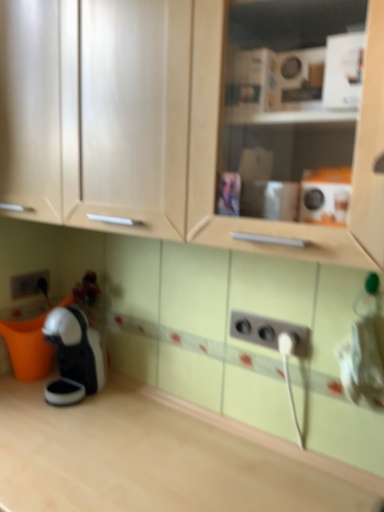
What are the coordinates of `white plastic outlet at lower center, acting as the 1th electric outlet starting from the front` in the screenshot? It's located at (269, 332).

This screenshot has width=384, height=512. What are the coordinates of `matte wood cabinet at upper center` in the screenshot? It's located at (151, 125).

The image size is (384, 512). What do you see at coordinates (77, 347) in the screenshot?
I see `black plastic coffee machine at lower left` at bounding box center [77, 347].

Where is `black plastic coffee machine at lower left`? The image size is (384, 512). black plastic coffee machine at lower left is located at coordinates (77, 347).

What is the approximate width of light wood countertop at lower left?

The width of light wood countertop at lower left is 51.89 centimeters.

The height and width of the screenshot is (512, 384). Describe the element at coordinates (158, 457) in the screenshot. I see `light wood countertop at lower left` at that location.

This screenshot has height=512, width=384. What are the coordinates of `white plastic outlet at lower center, the second electric outlet viewed from the left` in the screenshot? It's located at (269, 332).

Between black plastic coffee machine at lower left and matte wood cabinet at upper center, which one has larger width?

matte wood cabinet at upper center is wider.

Which of these two, black plastic coffee machine at lower left or matte wood cabinet at upper center, is bigger?

Bigger between the two is matte wood cabinet at upper center.

In the scene shown: Does black plastic coffee machine at lower left have a lesser height compared to matte wood cabinet at upper center?

Yes, black plastic coffee machine at lower left is shorter than matte wood cabinet at upper center.

Is black plastic coffee machine at lower left inside or outside of matte gray electric outlet at lower left, which ranks as the 1th electric outlet in top-to-bottom order?

The correct answer is: outside.

In the scene shown: Is black plastic coffee machine at lower left in front of or behind matte gray electric outlet at lower left, which is the 1th electric outlet from back to front, in the image?

black plastic coffee machine at lower left is positioned closer to the viewer than matte gray electric outlet at lower left, which is the 1th electric outlet from back to front.

Is point (62, 341) behind point (33, 272)?

No, it is in front of (33, 272).

Can you confirm if black plastic coffee machine at lower left is taller than matte gray electric outlet at lower left, which is the 1th electric outlet from back to front?

Correct, black plastic coffee machine at lower left is much taller as matte gray electric outlet at lower left, which is the 1th electric outlet from back to front.

Can you confirm if black plastic coffee machine at lower left is bigger than white plastic outlet at lower center, which is the second electric outlet in top-to-bottom order?

Yes, black plastic coffee machine at lower left is bigger than white plastic outlet at lower center, which is the second electric outlet in top-to-bottom order.

In the image, is black plastic coffee machine at lower left positioned in front of or behind white plastic outlet at lower center, placed as the first electric outlet when sorted from right to left?

Clearly, black plastic coffee machine at lower left is behind white plastic outlet at lower center, placed as the first electric outlet when sorted from right to left.

Which is correct: black plastic coffee machine at lower left is inside white plastic outlet at lower center, acting as the first electric outlet starting from the bottom, or outside of it?

The correct answer is: outside.

Is black plastic coffee machine at lower left facing away from white plastic outlet at lower center, the second electric outlet viewed from the left?

No, black plastic coffee machine at lower left is not facing away from white plastic outlet at lower center, the second electric outlet viewed from the left.

From a real-world perspective, which is physically below, matte gray electric outlet at lower left, which is counted as the second electric outlet, starting from the right, or light wood countertop at lower left?

In real-world perspective, light wood countertop at lower left is lower.

Is light wood countertop at lower left surrounded by matte gray electric outlet at lower left, which ranks as the 1th electric outlet in top-to-bottom order?

No, light wood countertop at lower left is not inside matte gray electric outlet at lower left, which ranks as the 1th electric outlet in top-to-bottom order.

Locate an element on the screen. the 1st electric outlet located above the light wood countertop at lower left (from a real-world perspective) is located at coordinates (28, 284).

Could you tell me if matte gray electric outlet at lower left, which is counted as the second electric outlet, starting from the right, is turned towards light wood countertop at lower left?

No.

Based on their sizes in the image, would you say light wood countertop at lower left is bigger or smaller than white plastic outlet at lower center, acting as the 1th electric outlet starting from the front?

In the image, light wood countertop at lower left appears to be larger than white plastic outlet at lower center, acting as the 1th electric outlet starting from the front.

Considering the relative positions of light wood countertop at lower left and white plastic outlet at lower center, acting as the first electric outlet starting from the bottom, in the image provided, is light wood countertop at lower left to the right of white plastic outlet at lower center, acting as the first electric outlet starting from the bottom, from the viewer's perspective?

No.

Between light wood countertop at lower left and white plastic outlet at lower center, acting as the first electric outlet starting from the bottom, which one has more height?

light wood countertop at lower left.

Is matte gray electric outlet at lower left, the second electric outlet from the front, at the left side of white plastic outlet at lower center, which is the second electric outlet in top-to-bottom order?

Correct, you'll find matte gray electric outlet at lower left, the second electric outlet from the front, to the left of white plastic outlet at lower center, which is the second electric outlet in top-to-bottom order.

Based on the photo, is matte gray electric outlet at lower left, which ranks as the 2th electric outlet in bottom-to-top order, touching white plastic outlet at lower center, acting as the first electric outlet starting from the bottom?

matte gray electric outlet at lower left, which ranks as the 2th electric outlet in bottom-to-top order, is not next to white plastic outlet at lower center, acting as the first electric outlet starting from the bottom, and they're not touching.

From the image's perspective, is matte gray electric outlet at lower left, which is the 1th electric outlet from back to front, beneath white plastic outlet at lower center, acting as the 1th electric outlet starting from the front?

Incorrect, from the image's perspective, matte gray electric outlet at lower left, which is the 1th electric outlet from back to front, is higher than white plastic outlet at lower center, acting as the 1th electric outlet starting from the front.

Is matte gray electric outlet at lower left, which is the 1th electric outlet from back to front, situated inside white plastic outlet at lower center, acting as the 1th electric outlet starting from the front, or outside?

matte gray electric outlet at lower left, which is the 1th electric outlet from back to front, is spatially situated outside white plastic outlet at lower center, acting as the 1th electric outlet starting from the front.

From the image's perspective, is matte wood cabinet at upper center under black plastic coffee machine at lower left?

No, from the image's perspective, matte wood cabinet at upper center is not beneath black plastic coffee machine at lower left.

Is matte wood cabinet at upper center facing away from black plastic coffee machine at lower left?

matte wood cabinet at upper center does not have its back to black plastic coffee machine at lower left.

Considering the relative sizes of matte wood cabinet at upper center and black plastic coffee machine at lower left in the image provided, is matte wood cabinet at upper center taller than black plastic coffee machine at lower left?

Indeed, matte wood cabinet at upper center has a greater height compared to black plastic coffee machine at lower left.

Locate an element on the screen. cabinetry above the black plastic coffee machine at lower left (from a real-world perspective) is located at coordinates (151, 125).

From the image's perspective, count 2nd electric outlets upward from the black plastic coffee machine at lower left and point to it. Please provide its 2D coordinates.

[(28, 284)]

From the image, which object appears to be farther from white plastic outlet at lower center, acting as the first electric outlet starting from the bottom, matte gray electric outlet at lower left, which ranks as the 2th electric outlet in bottom-to-top order, or light wood countertop at lower left?

matte gray electric outlet at lower left, which ranks as the 2th electric outlet in bottom-to-top order, is positioned further to the anchor white plastic outlet at lower center, acting as the first electric outlet starting from the bottom.

Which object lies nearer to the anchor point matte wood cabinet at upper center, matte gray electric outlet at lower left, which is the 1th electric outlet from back to front, or white plastic outlet at lower center, acting as the first electric outlet starting from the bottom?

Based on the image, white plastic outlet at lower center, acting as the first electric outlet starting from the bottom, appears to be nearer to matte wood cabinet at upper center.

When comparing their distances from black plastic coffee machine at lower left, does matte gray electric outlet at lower left, the first electric outlet positioned from the left, or matte wood cabinet at upper center seem closer?

matte gray electric outlet at lower left, the first electric outlet positioned from the left.

When comparing their distances from white plastic outlet at lower center, marked as the 2th electric outlet in a back-to-front arrangement, does matte wood cabinet at upper center or matte gray electric outlet at lower left, which ranks as the 2th electric outlet in bottom-to-top order, seem closer?

matte wood cabinet at upper center is closer to white plastic outlet at lower center, marked as the 2th electric outlet in a back-to-front arrangement.

Based on their spatial positions, is black plastic coffee machine at lower left or matte gray electric outlet at lower left, which ranks as the 1th electric outlet in top-to-bottom order, further from matte wood cabinet at upper center?

Among the two, matte gray electric outlet at lower left, which ranks as the 1th electric outlet in top-to-bottom order, is located further to matte wood cabinet at upper center.

Estimate the real-world distances between objects in this image. Which object is closer to light wood countertop at lower left, white plastic outlet at lower center, acting as the first electric outlet starting from the bottom, or matte wood cabinet at upper center?

Among the two, white plastic outlet at lower center, acting as the first electric outlet starting from the bottom, is located nearer to light wood countertop at lower left.

From the picture: From the image, which object appears to be farther from matte gray electric outlet at lower left, which is the 1th electric outlet from back to front, white plastic outlet at lower center, placed as the first electric outlet when sorted from right to left, or black plastic coffee machine at lower left?

Based on the image, white plastic outlet at lower center, placed as the first electric outlet when sorted from right to left, appears to be further to matte gray electric outlet at lower left, which is the 1th electric outlet from back to front.

Based on their spatial positions, is matte wood cabinet at upper center or light wood countertop at lower left further from matte gray electric outlet at lower left, which is counted as the second electric outlet, starting from the right?

matte wood cabinet at upper center.

Locate an element on the screen. Image resolution: width=384 pixels, height=512 pixels. toy between matte gray electric outlet at lower left, which is the 1th electric outlet from back to front, and white plastic outlet at lower center, acting as the 1th electric outlet starting from the front, from left to right is located at coordinates (77, 347).

Where is `toy between matte wood cabinet at upper center and light wood countertop at lower left in the vertical direction`? The width and height of the screenshot is (384, 512). toy between matte wood cabinet at upper center and light wood countertop at lower left in the vertical direction is located at coordinates (77, 347).

Where is `toy between matte wood cabinet at upper center and matte gray electric outlet at lower left, the first electric outlet positioned from the left, in the front-back direction`? The image size is (384, 512). toy between matte wood cabinet at upper center and matte gray electric outlet at lower left, the first electric outlet positioned from the left, in the front-back direction is located at coordinates [x=77, y=347].

Image resolution: width=384 pixels, height=512 pixels. I want to click on electric outlet between matte wood cabinet at upper center and matte gray electric outlet at lower left, which ranks as the 1th electric outlet in top-to-bottom order, in the front-back direction, so click(x=269, y=332).